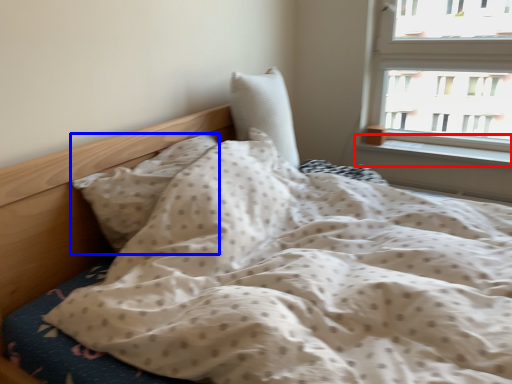
Question: Among these objects, which one is nearest to the camera, window sill (highlighted by a red box) or pillow (highlighted by a blue box)?

Choices:
 (A) window sill
 (B) pillow

Answer: (B)